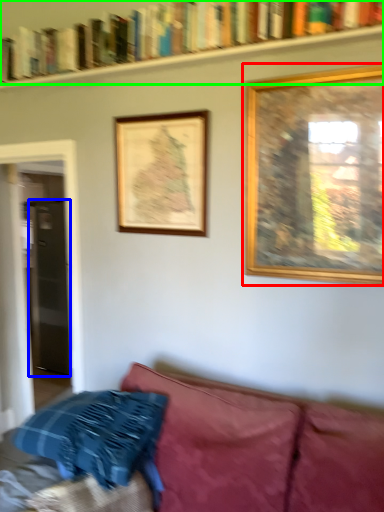
Question: Which object is positioned farthest from picture frame (highlighted by a red box)? Select from glass door (highlighted by a blue box) and book (highlighted by a green box).

Choices:
 (A) glass door
 (B) book

Answer: (A)